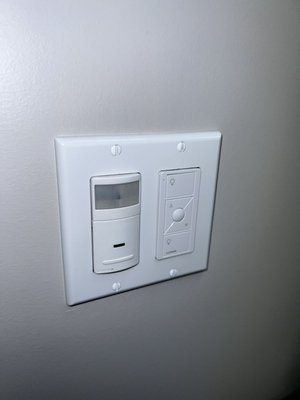
This screenshot has width=300, height=400. Identify the location of light sensor. (120, 201).